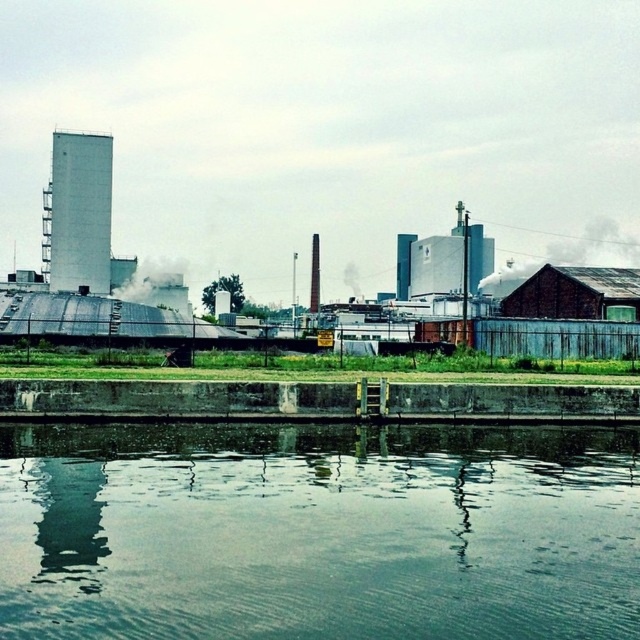
You are a drone operator trying to capture a photo of the green reflective water at center and white smoke at center. The camera has a maximum focus range of 80 meters. Can you capture both objects in focus without moving the drone?

The green reflective water at center and white smoke at center are 87.64 meters apart, which exceeds the camera maximum focus range of 80 meters. Therefore, the drone operator cannot capture both objects in focus without moving the drone.